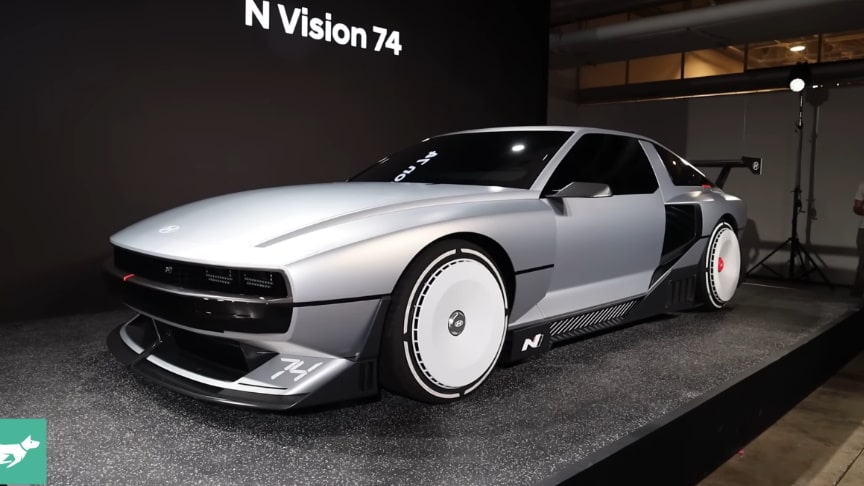
This screenshot has height=486, width=864. Find the location of `wooden flooring`. wooden flooring is located at coordinates (804, 436).